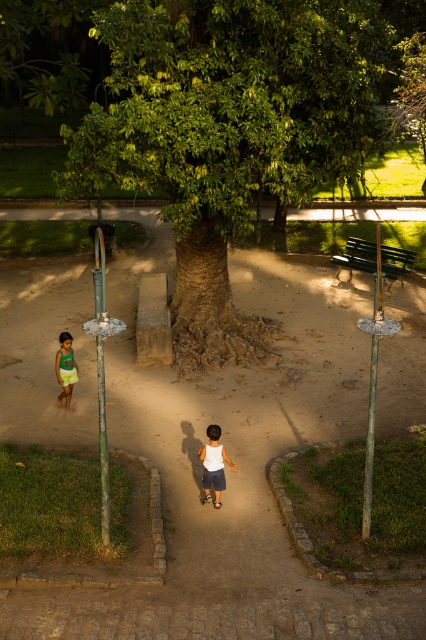
Question: Can you confirm if white matte shorts at center is wider than green jersey at lower left?

Choices:
 (A) yes
 (B) no

Answer: (A)

Question: Can you confirm if white matte shorts at center is positioned to the left of green jersey at lower left?

Choices:
 (A) no
 (B) yes

Answer: (A)

Question: Which of these objects is positioned closest to the brown dirt path at center?

Choices:
 (A) white matte shorts at center
 (B) green rough bark tree at center
 (C) green jersey at lower left

Answer: (A)

Question: Is green rough bark tree at center behind green jersey at lower left?

Choices:
 (A) yes
 (B) no

Answer: (B)

Question: Which of these objects is positioned farthest from the green jersey at lower left?

Choices:
 (A) green rough bark tree at center
 (B) white matte shorts at center

Answer: (A)

Question: Based on their relative distances, which object is nearer to the white matte shorts at center?

Choices:
 (A) brown dirt path at center
 (B) green jersey at lower left
 (C) green rough bark tree at center

Answer: (B)